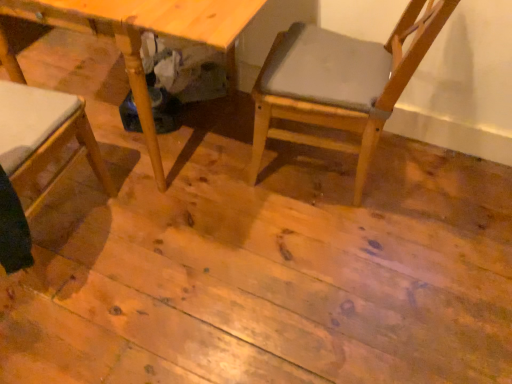
The height and width of the screenshot is (384, 512). I want to click on vacant space in between light brown wood chair at center and natural wood table at center, so coord(284,206).